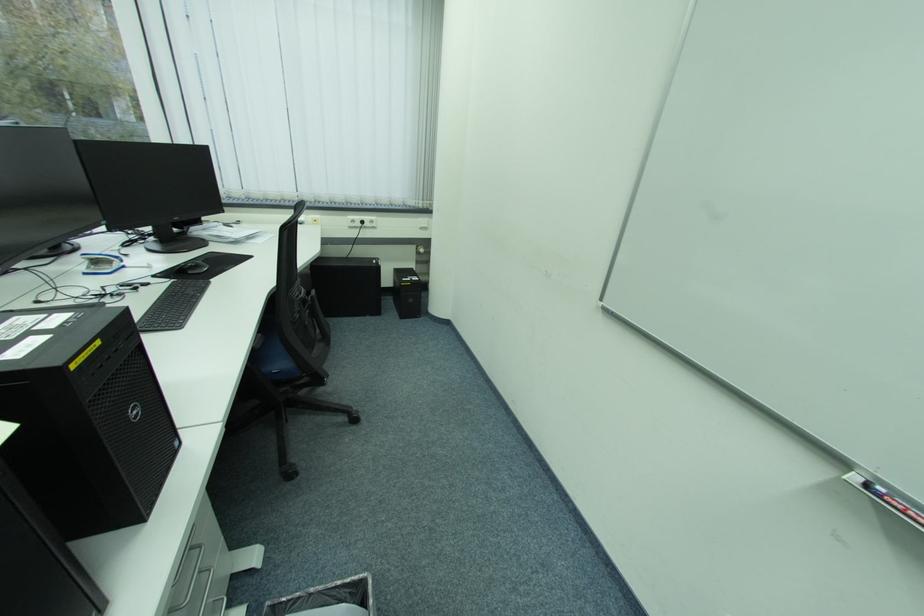
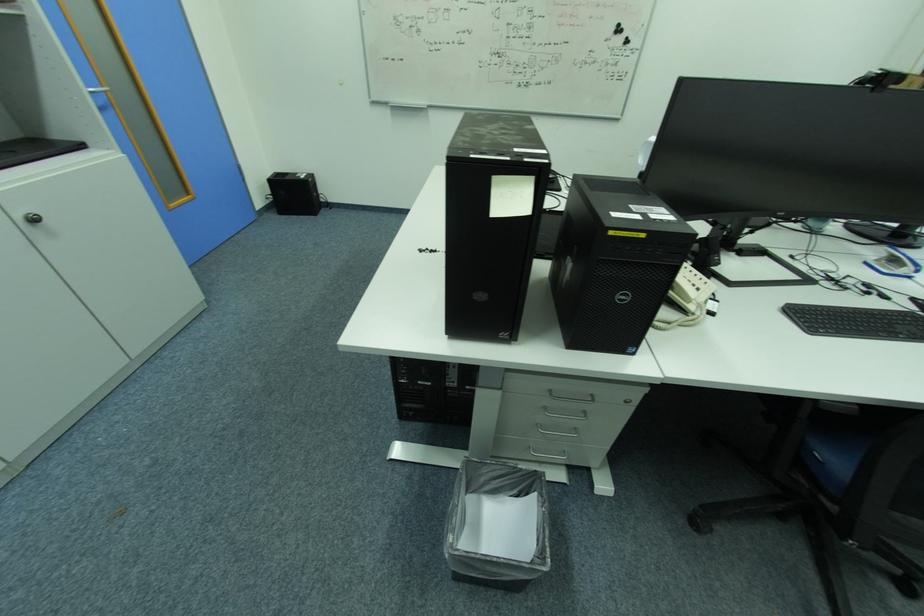
The images are taken continuously from a first-person perspective. In which direction is your viewpoint rotating?

The camera's rotation is toward left-down.